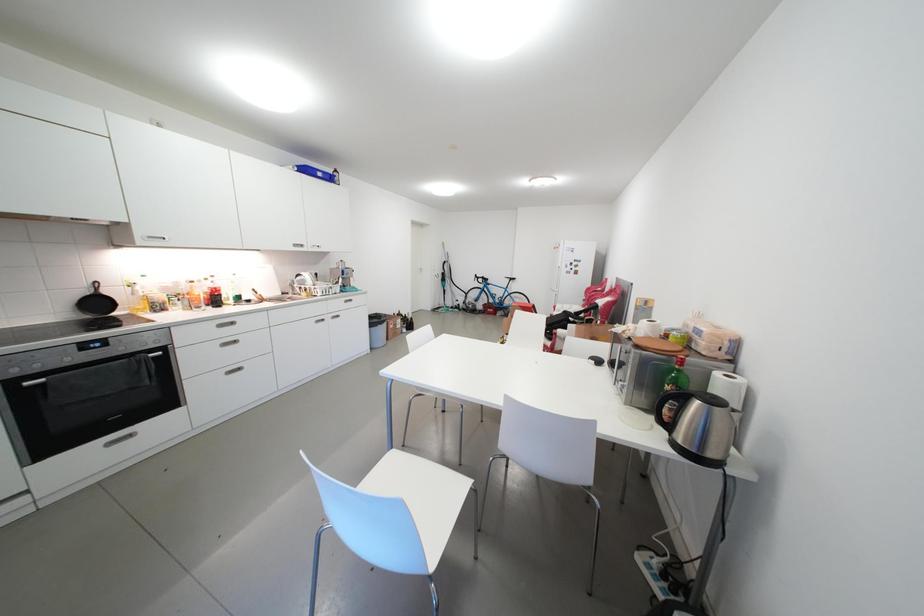
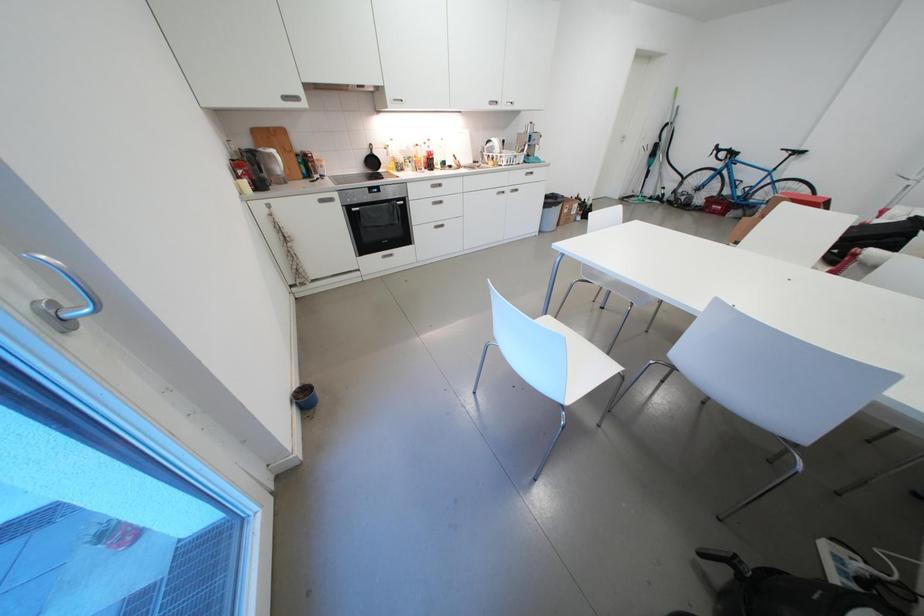
First-person continuous shooting, in which direction is the camera rotating?

The rotation direction of the camera is left-down.